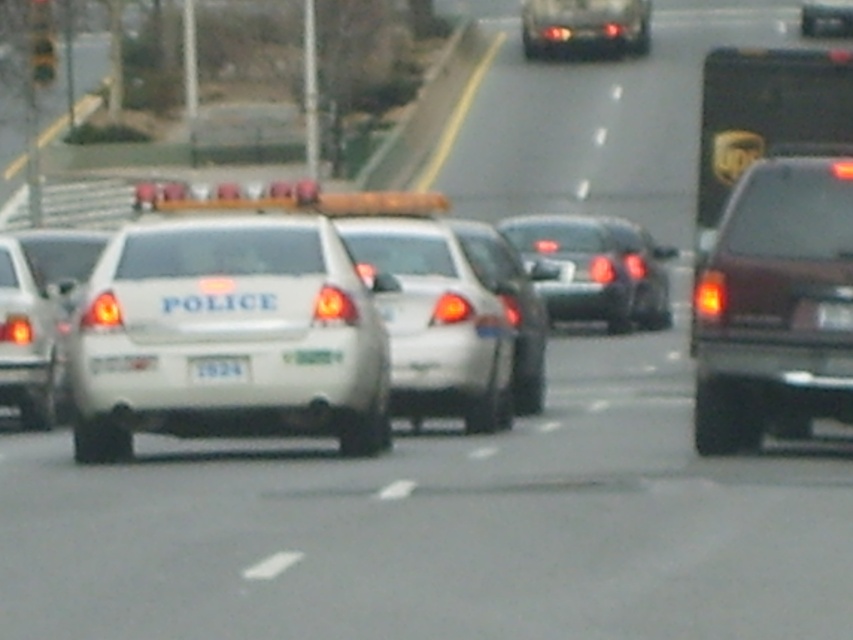
Is glossy black sedan at center taller than white plastic license plate at center?

Correct, glossy black sedan at center is much taller as white plastic license plate at center.

Who is shorter, glossy black sedan at center or white plastic license plate at center?

white plastic license plate at center is shorter.

Between point (654, 269) and point (212, 364), which one is positioned in front?

Positioned in front is point (212, 364).

This screenshot has width=853, height=640. I want to click on glossy black sedan at center, so click(598, 268).

Which is more to the right, dark red plastic suv at right or shiny silver sedan at upper center?

From the viewer's perspective, shiny silver sedan at upper center appears more on the right side.

Image resolution: width=853 pixels, height=640 pixels. Find the location of `dark red plastic suv at right`. dark red plastic suv at right is located at coordinates (775, 305).

Is point (749, 252) in front of point (599, 8)?

Yes.

Find the location of `dark red plastic suv at right`. dark red plastic suv at right is located at coordinates (775, 305).

Is the position of dark red plastic suv at right less distant than that of yellow matte traffic light at upper left?

Yes.

Does dark red plastic suv at right have a greater height compared to yellow matte traffic light at upper left?

No, dark red plastic suv at right is not taller than yellow matte traffic light at upper left.

Measure the distance between dark red plastic suv at right and camera.

14.25 meters

The image size is (853, 640). In order to click on dark red plastic suv at right in this screenshot , I will do `click(775, 305)`.